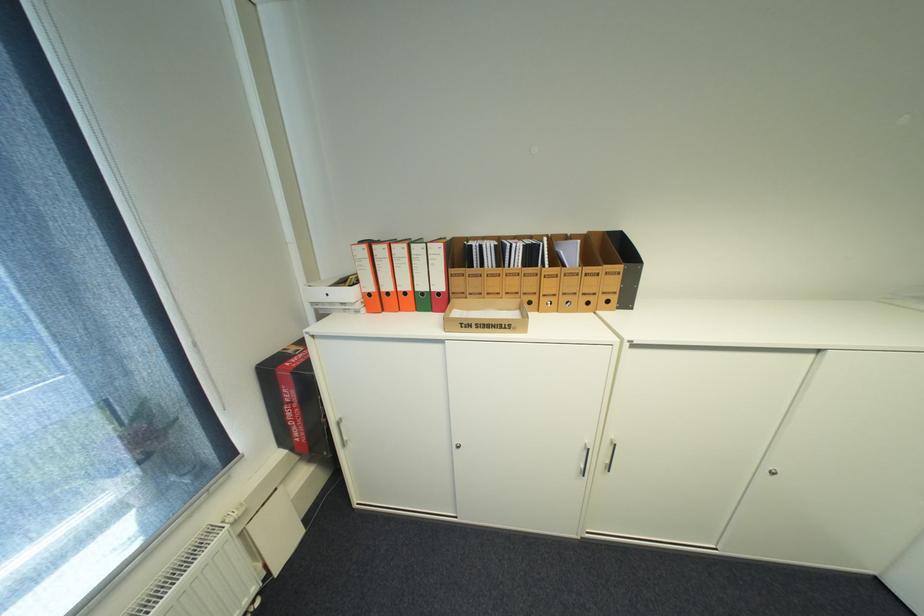
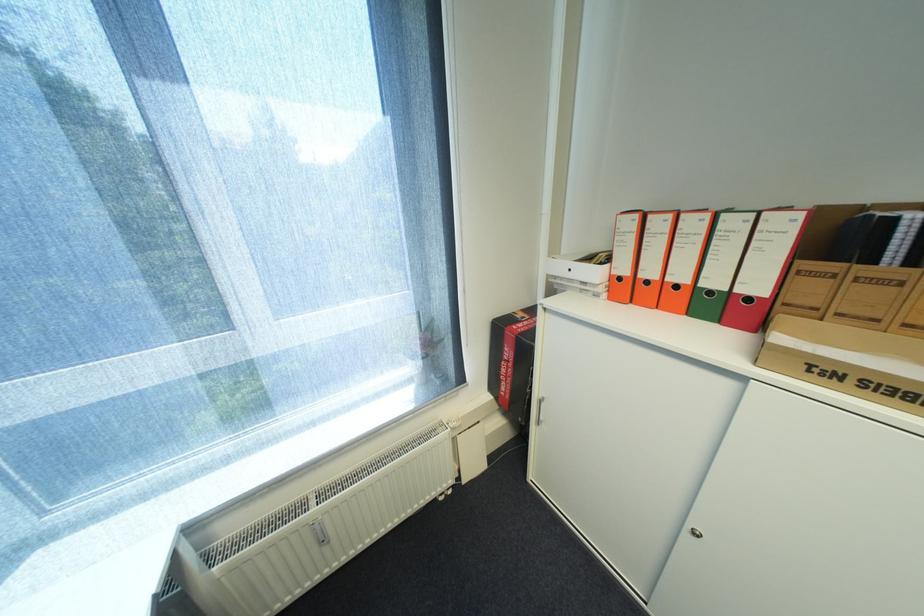
Where in the second image is the point corresponding to (x=395, y=294) from the first image?

(655, 283)